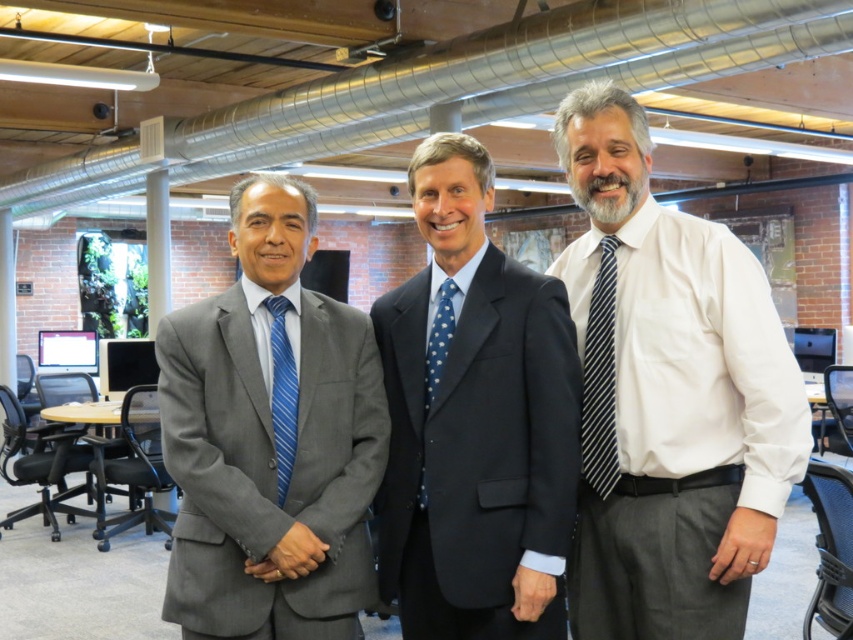
Question: Does blue striped tie at right appear on the left side of blue dotted fabric tie at center?

Choices:
 (A) no
 (B) yes

Answer: (A)

Question: Which point appears closest to the camera in this image?

Choices:
 (A) (442, 296)
 (B) (286, 428)

Answer: (B)

Question: Is white striped tie at center above blue striped tie at center?

Choices:
 (A) yes
 (B) no

Answer: (A)

Question: Which of the following is the closest to the observer?

Choices:
 (A) (437, 292)
 (B) (705, 584)
 (C) (405, 634)
 (D) (277, 428)

Answer: (B)

Question: Which point is farther from the camera taking this photo?

Choices:
 (A) (602, 396)
 (B) (282, 460)
 (C) (447, 310)

Answer: (C)

Question: Can you confirm if gray suit at center is thinner than dark blue suit at center?

Choices:
 (A) yes
 (B) no

Answer: (B)